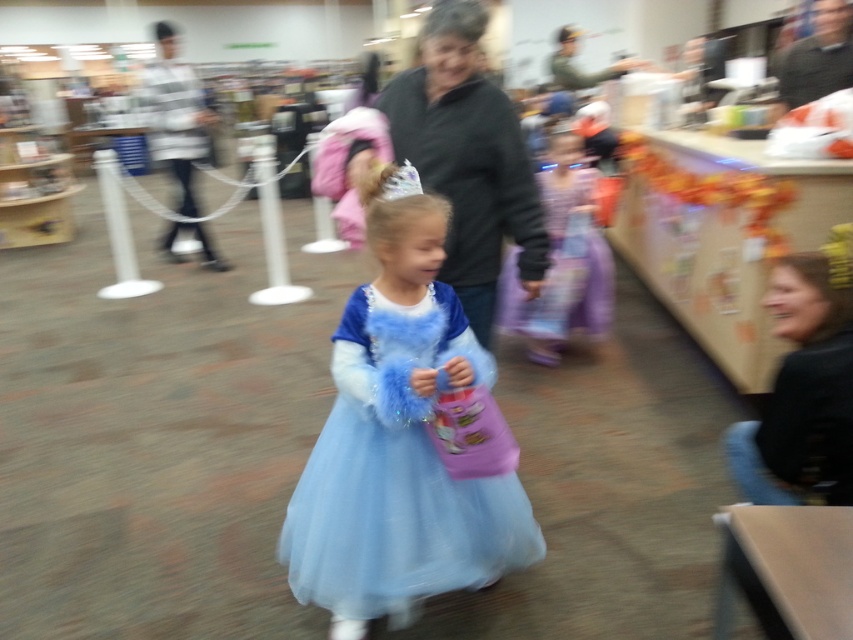
From the picture: You are standing at the point marked as point (395, 381) in the image. You want to take a photo of the young girl in the light blue princess dress holding the pink purse. Will you be able to capture her clearly in the photo without moving from your current position?

The distance of point (395, 381) from camera is 4.72 feet. Since the girl is in the foreground and the point is at a moderate distance, it is likely possible to capture her clearly without moving, provided the camera has a sufficient zoom or wide enough lens. However, the exact clarity also depends on the camera settings and any potential obstructions not mentioned in the scene description.

Looking at this image, you are a store employee who needs to place a new mannequin in the center of the store. There is a light blue tulle dress at center and a dark gray sweater at center. Can you fit the mannequin between them if it requires 60 centimeters of space?

The light blue tulle dress at center and dark gray sweater at center are 57.96 centimeters apart. Since the required space for the mannequin is 60 centimeters, the mannequin cannot fit between them as the available space is less than required.